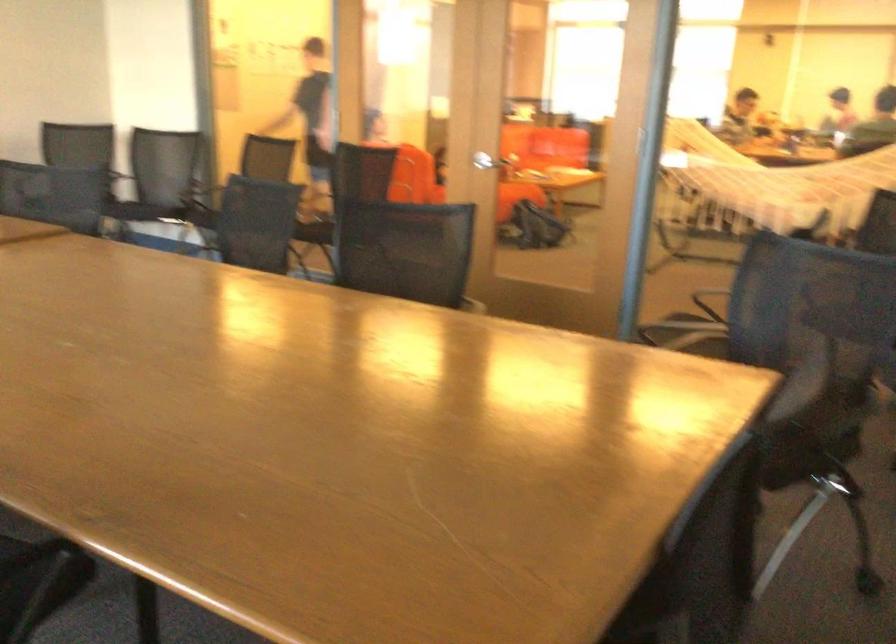
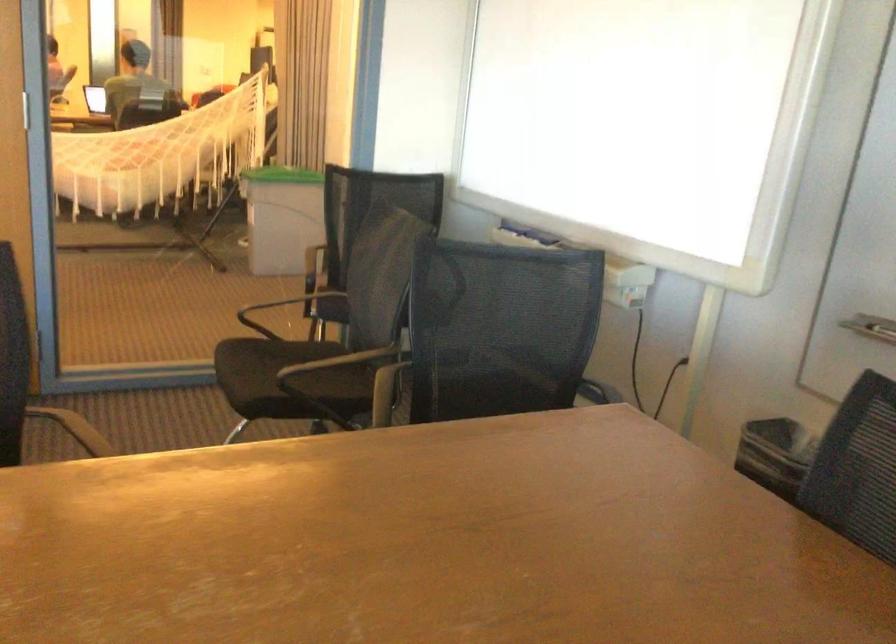
Where in the second image is the point corresponding to (x=806, y=322) from the first image?

(501, 328)